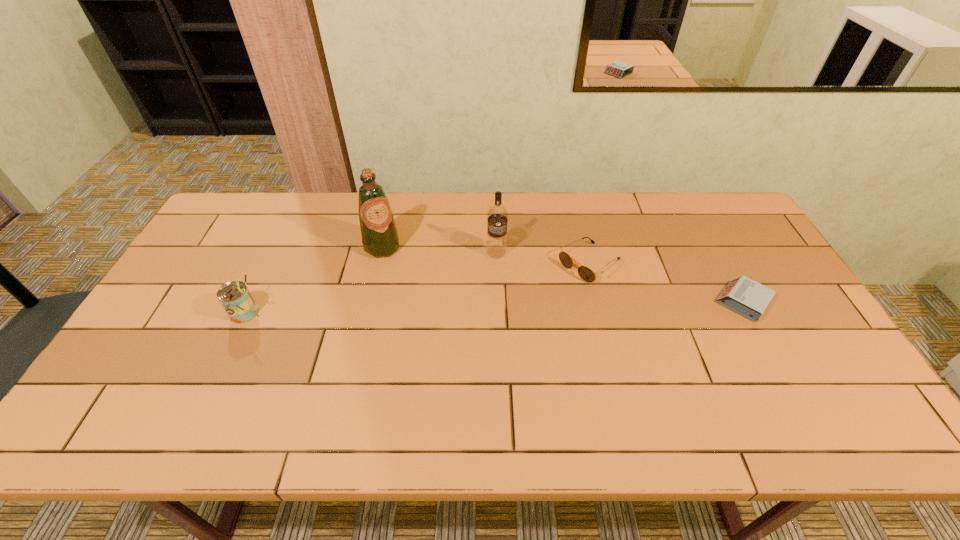
Identify the location of free space located on the back of the leftmost object. (284, 231).

Image resolution: width=960 pixels, height=540 pixels. I want to click on vacant space located on the back of the alarm clock, so click(x=698, y=220).

Identify the location of free spot located on the label of the third object from left to right. (486, 335).

Identify the location of free space located 0.160m on the label of the third object from left to right. This screenshot has height=540, width=960. (491, 298).

The width and height of the screenshot is (960, 540). I want to click on free point located on the label of the third object from left to right, so click(x=490, y=306).

You are a GUI agent. You are given a task and a screenshot of the screen. Output one action in this format:
    pyautogui.click(x=<x>, y=<y>)
    Task: Click on the vacant region located 0.200m on the front-facing side of the tallest object
    The width and height of the screenshot is (960, 540).
    Given the screenshot: What is the action you would take?
    pyautogui.click(x=417, y=300)

Where is `vacant area located on the front-facing side of the tallest object`? This screenshot has height=540, width=960. vacant area located on the front-facing side of the tallest object is located at coordinates (408, 286).

Find the location of a particular element. free space located 0.300m on the front-facing side of the tallest object is located at coordinates (432, 323).

The height and width of the screenshot is (540, 960). I want to click on vacant space positioned on the lenses of the sunglasses, so click(x=543, y=296).

You are a GUI agent. You are given a task and a screenshot of the screen. Output one action in this format:
    pyautogui.click(x=<x>, y=<y>)
    Task: Click on the free spot located on the lenses of the sunglasses
    This screenshot has height=540, width=960.
    Given the screenshot: What is the action you would take?
    pyautogui.click(x=553, y=289)